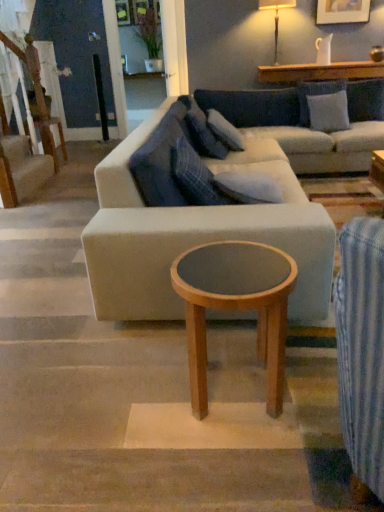
Question: From a real-world perspective, is blue plaid pillow at center, which ranks as the 4th pillow in back-to-front order, physically above light brown wood coffee table at center?

Choices:
 (A) yes
 (B) no

Answer: (A)

Question: Is light brown wood coffee table at center surrounded by blue plaid pillow at center, the fourth pillow from the right?

Choices:
 (A) yes
 (B) no

Answer: (B)

Question: From the image's perspective, is blue plaid pillow at center, which ranks as the 4th pillow in back-to-front order, located beneath light brown wood coffee table at center?

Choices:
 (A) yes
 (B) no

Answer: (B)

Question: Is the depth of blue plaid pillow at center, which is the 1th pillow in left-to-right order, greater than that of light brown wood coffee table at center?

Choices:
 (A) no
 (B) yes

Answer: (B)

Question: Is blue plaid pillow at center, which is the 1th pillow in left-to-right order, positioned beyond the bounds of light brown wood coffee table at center?

Choices:
 (A) yes
 (B) no

Answer: (A)

Question: Looking at their shapes, would you say light brown wood coffee table at center is wider or thinner than wooden staircase at left?

Choices:
 (A) thin
 (B) wide

Answer: (B)

Question: From the image's perspective, is light brown wood coffee table at center positioned above or below wooden staircase at left?

Choices:
 (A) above
 (B) below

Answer: (B)

Question: From a real-world perspective, is light brown wood coffee table at center above or below wooden staircase at left?

Choices:
 (A) below
 (B) above

Answer: (B)

Question: Would you say light brown wood coffee table at center is to the left or to the right of wooden staircase at left in the picture?

Choices:
 (A) left
 (B) right

Answer: (B)

Question: Considering the positions of gray fabric pillow at center, which is the 2th pillow from right to left, and wooden round table at left in the image, is gray fabric pillow at center, which is the 2th pillow from right to left, taller or shorter than wooden round table at left?

Choices:
 (A) tall
 (B) short

Answer: (B)

Question: From the image's perspective, is gray fabric pillow at center, arranged as the 2th pillow when viewed from the back, above or below wooden round table at left?

Choices:
 (A) above
 (B) below

Answer: (B)

Question: Do you think gray fabric pillow at center, the 3th pillow positioned from the left, is within wooden round table at left, or outside of it?

Choices:
 (A) inside
 (B) outside

Answer: (B)

Question: In terms of size, does gray fabric pillow at center, arranged as the 2th pillow when viewed from the back, appear bigger or smaller than wooden round table at left?

Choices:
 (A) small
 (B) big

Answer: (A)

Question: Is gray fabric pillow at center, the 3th pillow positioned from the left, bigger or smaller than light gray fabric couch at center?

Choices:
 (A) big
 (B) small

Answer: (B)

Question: Considering their positions, is gray fabric pillow at center, arranged as the 2th pillow when viewed from the back, located in front of or behind light gray fabric couch at center?

Choices:
 (A) front
 (B) behind

Answer: (B)